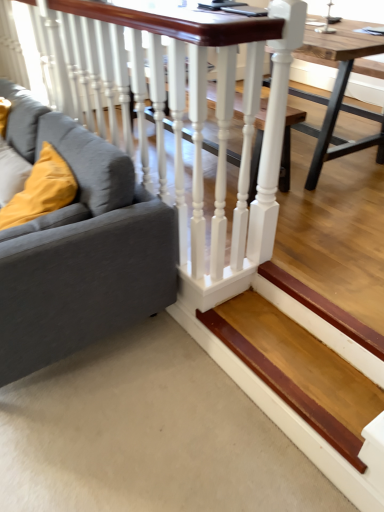
Question: Is gray fabric couch at left taller than wooden table at center?

Choices:
 (A) yes
 (B) no

Answer: (A)

Question: Does gray fabric couch at left appear on the left side of wooden table at center?

Choices:
 (A) yes
 (B) no

Answer: (A)

Question: Is gray fabric couch at left looking in the opposite direction of wooden table at center?

Choices:
 (A) yes
 (B) no

Answer: (A)

Question: Is gray fabric couch at left not inside wooden table at center?

Choices:
 (A) yes
 (B) no

Answer: (A)

Question: From the image's perspective, is gray fabric couch at left below wooden table at center?

Choices:
 (A) no
 (B) yes

Answer: (B)

Question: Is wooden table at center a part of gray fabric couch at left?

Choices:
 (A) yes
 (B) no

Answer: (B)

Question: Is white glossy rail at upper left far away from velvet yellow pillow at left?

Choices:
 (A) yes
 (B) no

Answer: (B)

Question: Is white glossy rail at upper left outside of velvet yellow pillow at left?

Choices:
 (A) yes
 (B) no

Answer: (A)

Question: Is white glossy rail at upper left placed right next to velvet yellow pillow at left?

Choices:
 (A) no
 (B) yes

Answer: (A)

Question: From the image's perspective, does white glossy rail at upper left appear lower than velvet yellow pillow at left?

Choices:
 (A) yes
 (B) no

Answer: (B)

Question: Is the position of white glossy rail at upper left more distant than that of velvet yellow pillow at left?

Choices:
 (A) no
 (B) yes

Answer: (A)

Question: Is white glossy rail at upper left at the right side of velvet yellow pillow at left?

Choices:
 (A) no
 (B) yes

Answer: (B)

Question: Is white glossy rail at upper left completely or partially inside velvet yellow pillow at left?

Choices:
 (A) no
 (B) yes

Answer: (A)